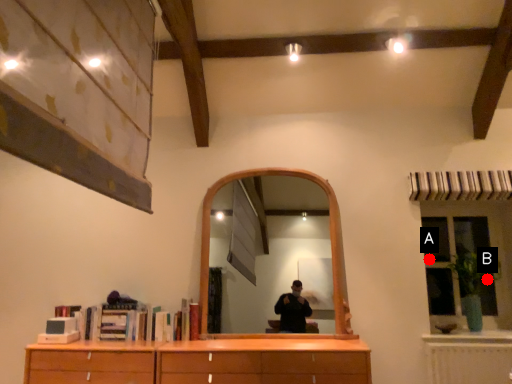
Question: Two points are circled on the image, labeled by A and B beside each circle. Among these points, which one is nearest to the camera?

Choices:
 (A) A is closer
 (B) B is closer

Answer: (B)